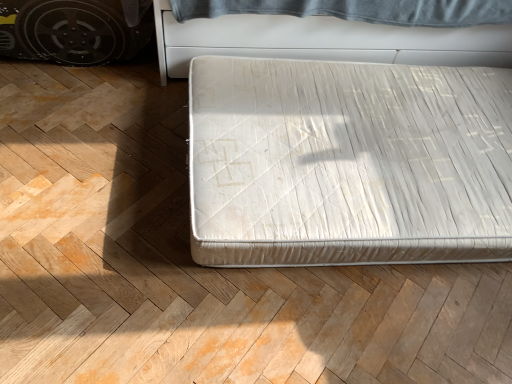
Image resolution: width=512 pixels, height=384 pixels. Find the location of `white fabric bed at center`. white fabric bed at center is located at coordinates (348, 163).

Describe the element at coordinates (348, 163) in the screenshot. I see `white fabric bed at center` at that location.

In order to face white fabric mattress at center, should I rotate leftwards or rightwards?

Turn right by 16.926 degrees to look at white fabric mattress at center.

What do you see at coordinates (324, 41) in the screenshot? This screenshot has width=512, height=384. I see `white fabric mattress at center` at bounding box center [324, 41].

Find the location of a particular element. white fabric mattress at center is located at coordinates (324, 41).

I want to click on white fabric bed at center, so pos(348,163).

Between white fabric bed at center and white fabric mattress at center, which one appears on the left side from the viewer's perspective?

white fabric bed at center is more to the left.

Does white fabric bed at center lie in front of white fabric mattress at center?

Yes, it is in front of white fabric mattress at center.

Is point (197, 136) farther from viewer compared to point (489, 51)?

No, it is in front of (489, 51).

From the image's perspective, is white fabric bed at center under white fabric mattress at center?

Yes, from the image's perspective, white fabric bed at center is beneath white fabric mattress at center.

From a real-world perspective, is white fabric bed at center positioned under white fabric mattress at center based on gravity?

Yes, from a real-world perspective, white fabric bed at center is under white fabric mattress at center.

Which of these two, white fabric bed at center or white fabric mattress at center, is wider?

white fabric bed at center.

Which of these two, white fabric bed at center or white fabric mattress at center, stands shorter?

white fabric bed at center is shorter.

Is white fabric bed at center smaller than white fabric mattress at center?

Correct, white fabric bed at center occupies less space than white fabric mattress at center.

Is white fabric bed at center surrounding white fabric mattress at center?

No, white fabric mattress at center is not a part of white fabric bed at center.

Would you say white fabric bed at center is a long distance from white fabric mattress at center?

No, white fabric bed at center is in close proximity to white fabric mattress at center.

Could you tell me if white fabric bed at center is turned towards white fabric mattress at center?

No, white fabric bed at center is not oriented towards white fabric mattress at center.

How many degrees apart are the facing directions of white fabric bed at center and white fabric mattress at center?

91.6 degrees.

How far apart are white fabric bed at center and white fabric mattress at center?

They are 45.92 centimeters apart.

Identify the location of furniture above the white fabric bed at center (from a real-world perspective). (324, 41).

Considering the relative positions of white fabric mattress at center and white fabric bed at center in the image provided, is white fabric mattress at center to the right of white fabric bed at center from the viewer's perspective?

Yes.

Which object is closer to the camera, white fabric mattress at center or white fabric bed at center?

white fabric bed at center.

Is point (362, 39) more distant than point (356, 156)?

Yes.

From the image's perspective, is white fabric mattress at center on top of white fabric bed at center?

Yes.

From a real-world perspective, does white fabric mattress at center sit lower than white fabric bed at center?

Actually, white fabric mattress at center is physically above white fabric bed at center in the real world.

Is white fabric mattress at center wider or thinner than white fabric bed at center?

white fabric mattress at center is thinner than white fabric bed at center.

In terms of height, does white fabric mattress at center look taller or shorter compared to white fabric bed at center?

white fabric mattress at center is taller than white fabric bed at center.

Is white fabric mattress at center bigger or smaller than white fabric bed at center?

In the image, white fabric mattress at center appears to be larger than white fabric bed at center.

From the picture: Do you think white fabric mattress at center is within white fabric bed at center, or outside of it?

white fabric mattress at center is not inside white fabric bed at center, it's outside.

In the scene shown: Are white fabric mattress at center and white fabric bed at center making contact?

white fabric mattress at center and white fabric bed at center are not in contact.

Is white fabric mattress at center oriented towards white fabric bed at center?

Yes, white fabric mattress at center is turned towards white fabric bed at center.

What's the angular difference between white fabric mattress at center and white fabric bed at center's facing directions?

white fabric mattress at center and white fabric bed at center are facing 91.6 degrees away from each other.

Measure the distance from white fabric mattress at center to white fabric bed at center.

white fabric mattress at center is 18.08 inches from white fabric bed at center.

Image resolution: width=512 pixels, height=384 pixels. In the image, there is a white fabric bed at center. In order to click on furniture above it (from the image's perspective) in this screenshot , I will do `click(324, 41)`.

Where is `furniture above the white fabric bed at center (from a real-world perspective)`? The image size is (512, 384). furniture above the white fabric bed at center (from a real-world perspective) is located at coordinates (324, 41).

This screenshot has height=384, width=512. Identify the location of bed located in front of the white fabric mattress at center. point(348,163).